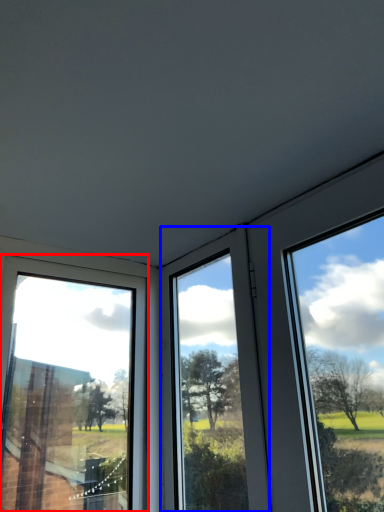
Question: Which of the following is the closest to the observer, window (highlighted by a red box) or window (highlighted by a blue box)?

Choices:
 (A) window
 (B) window

Answer: (A)